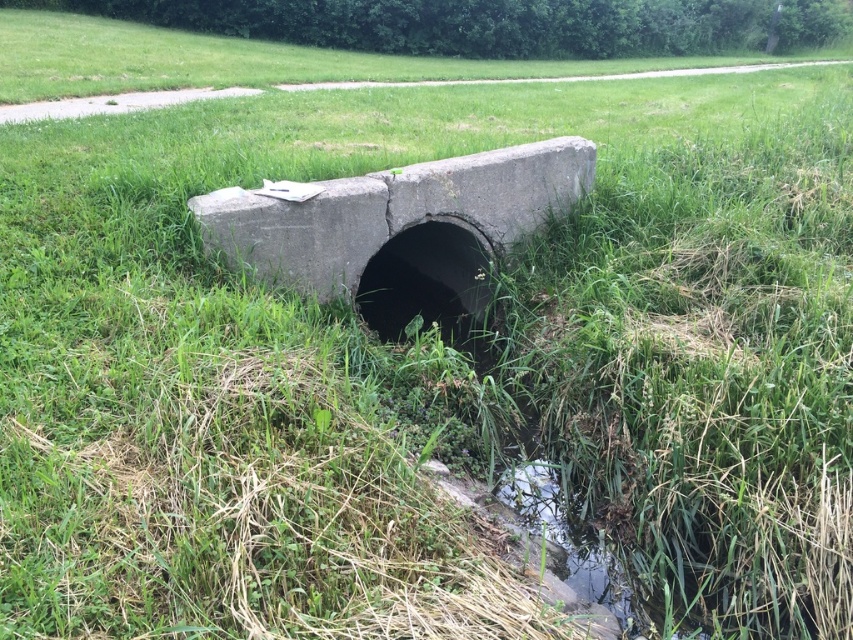
You are a maintenance worker inspecting the gray concrete culvert at center and the concrete pipe at center. Which one is closer to you?

The gray concrete culvert at center is closer to you because it is in front of the concrete pipe at center.

You are standing at the point labeled point (x=393, y=211) in the image. Based on the scene description, what structure are you most likely standing on?

You are most likely standing on the gray concrete culvert at center, as the point (x=393, y=211) corresponds to it according to the objects description.

You are a maintenance worker inspecting the gray concrete culvert at center and the concrete pipe at center. Which structure requires immediate attention due to its height being insufficient for water flow?

The concrete pipe at center requires immediate attention because it is shorter than the gray concrete culvert at center, which may lead to inadequate water flow capacity.